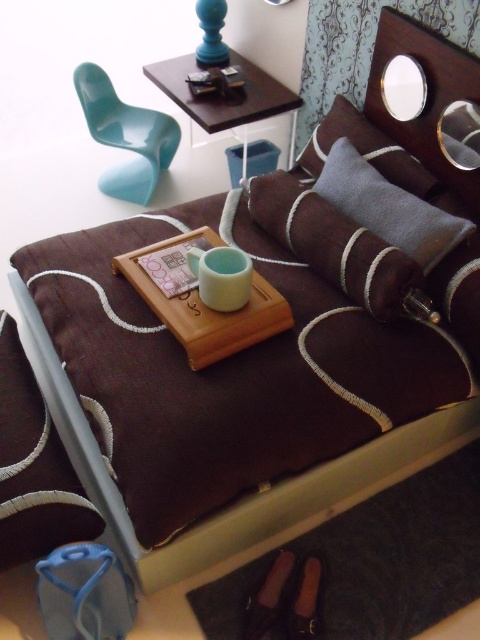
You are arranging a small table between the brown textured pillow at center and the glossy plastic chair at upper left. Based on their positions, where should you place the table?

The brown textured pillow at center is located below the glossy plastic chair at upper left, so the table should be placed between them in the space below the glossy plastic chair at upper left and above the brown textured pillow at center.

You are standing in the room and want to sit down. There is a glossy plastic chair at upper left and a dark wood table at upper center. Which object is closer to you?

The glossy plastic chair at upper left is closer to you because it is further to the viewer than the dark wood table at upper center, meaning it is positioned nearer in the room.